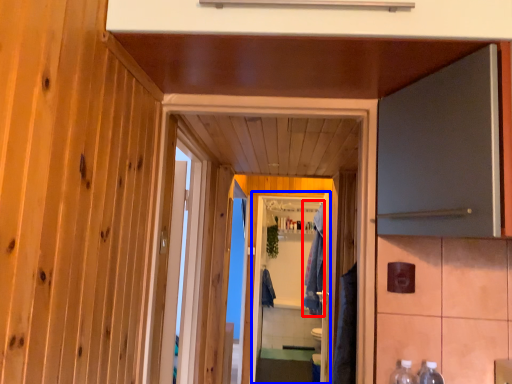
Question: Which object appears closest to the camera in this image, robe (highlighted by a red box) or screen door (highlighted by a blue box)?

Choices:
 (A) robe
 (B) screen door

Answer: (A)